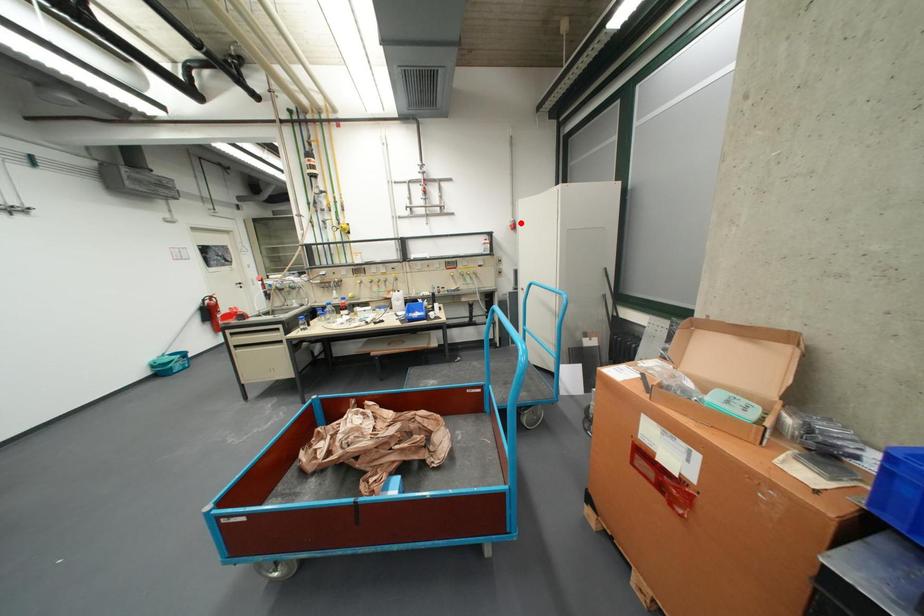
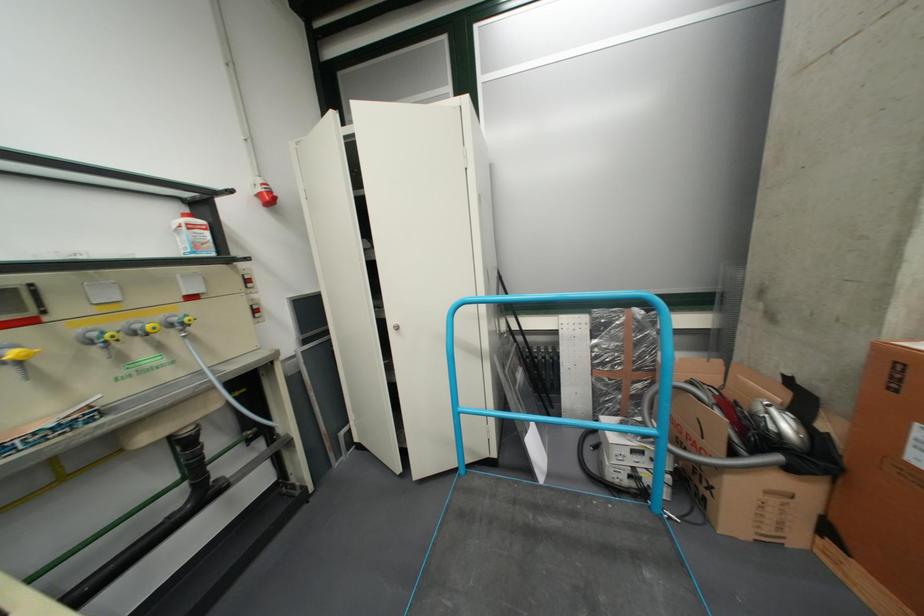
Question: A red point is marked in image1. In image2, is the corresponding 3D point closer to the camera or farther? Reply with the corresponding letter.

Choices:
 (A) The corresponding 3D point is closer.
 (B) The corresponding 3D point is farther.

Answer: (B)